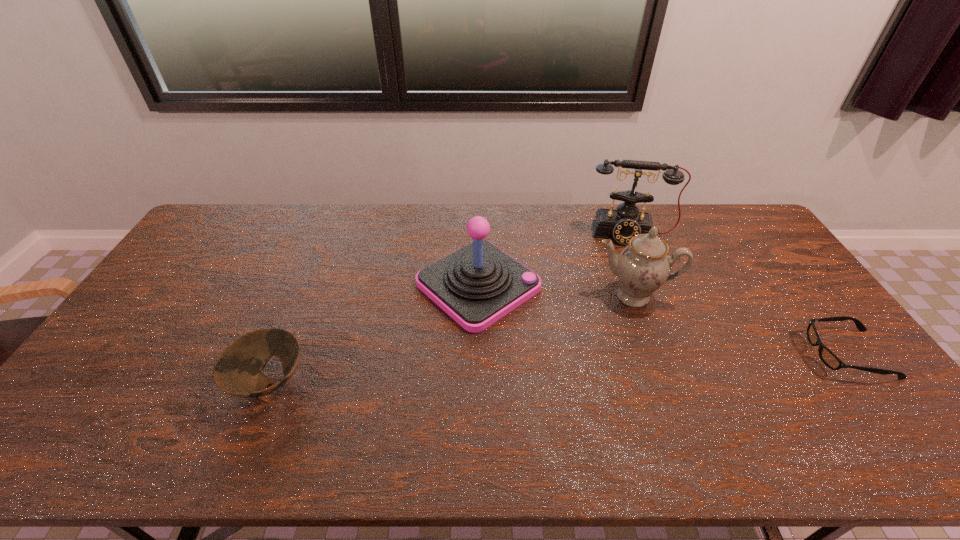
You are a GUI agent. You are given a task and a screenshot of the screen. Output one action in this format:
    pyautogui.click(x=<x>, y=<y>)
    Task: Click on the leftmost object
    Image resolution: width=960 pixels, height=540 pixels.
    Given the screenshot: What is the action you would take?
    pyautogui.click(x=238, y=371)

Locate an element on the screen. The image size is (960, 540). the second shortest object is located at coordinates (238, 371).

The image size is (960, 540). I want to click on the shortest object, so click(x=826, y=355).

I want to click on the rightmost object, so click(826, 355).

Identify the location of joystick. (478, 284).

Identify the location of telephone. (625, 222).

This screenshot has height=540, width=960. I want to click on chinaware, so click(x=642, y=266).

Where is `vacant area situated 0.070m on the left of the fourth tallest object`? The height and width of the screenshot is (540, 960). vacant area situated 0.070m on the left of the fourth tallest object is located at coordinates (204, 382).

The image size is (960, 540). Find the location of `vacant region located 0.230m on the front-facing side of the shortest object`. vacant region located 0.230m on the front-facing side of the shortest object is located at coordinates (727, 354).

Where is `free space located 0.210m on the front-facing side of the shortest object`? Image resolution: width=960 pixels, height=540 pixels. free space located 0.210m on the front-facing side of the shortest object is located at coordinates (734, 354).